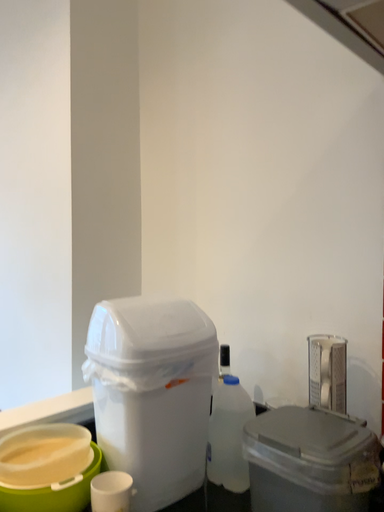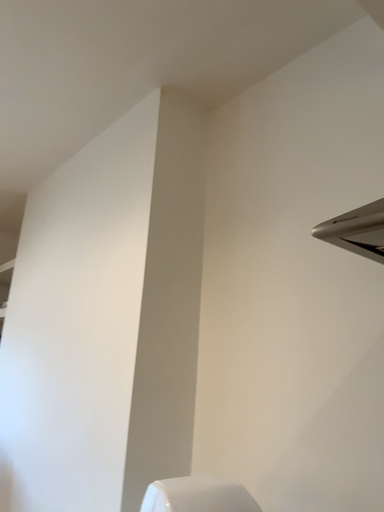
Question: How did the camera likely rotate when shooting the video?

Choices:
 (A) rotated downward
 (B) rotated upward

Answer: (B)